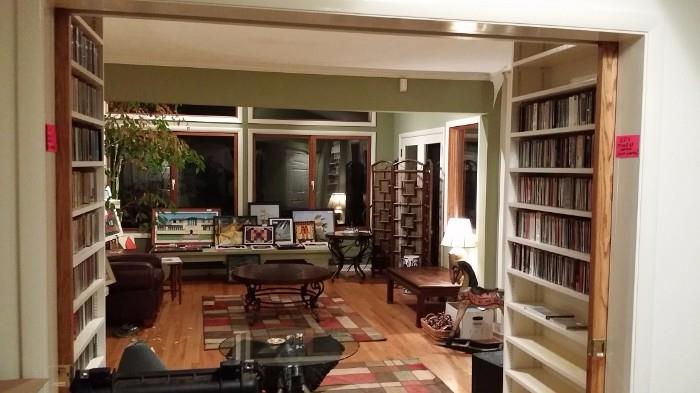
Locate an element on the screen. This screenshot has height=393, width=700. basket is located at coordinates (430, 330).